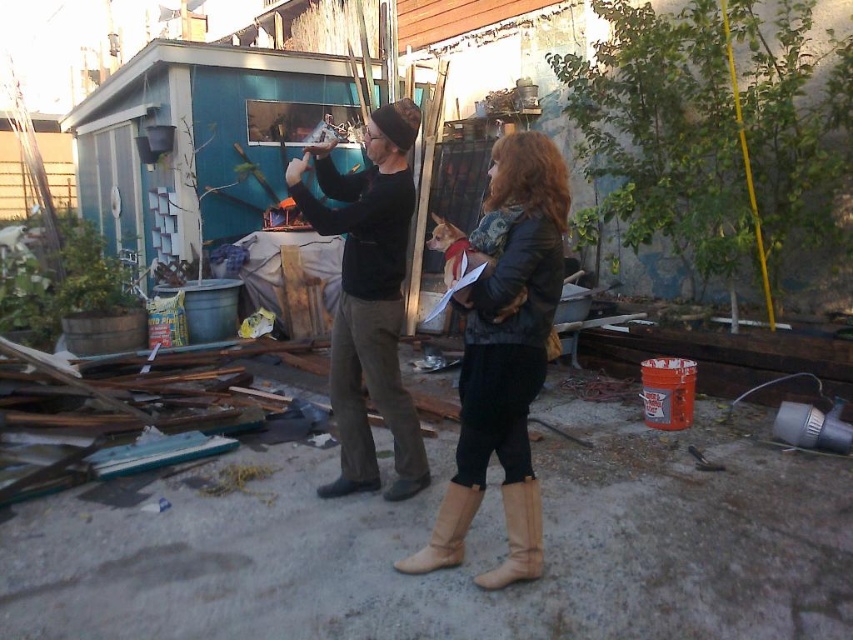
You are standing in the backyard and want to place a small potted plant between the two points labeled point (345,474) and point (520,552). Which point should the plant be closer to so that it is nearer to the viewer?

The plant should be placed closer to point (345,474) because it is closer to the viewer than point (520,552).

Based on the photo, you are a delivery person who needs to place a package between the black matte pants at center and the tan suede boots at center. The package is 30 inches long. Can you fit it between them without moving either item?

The distance between the black matte pants at center and the tan suede boots at center is 28.79 inches. Since the package is 30 inches long, it cannot fit between them without moving either item.

You are a delivery robot with a width of 24 inches. You need to navigate through the space between the black matte pants at center and the tan suede boot at lower center to deliver a package. Can you fit through this space?

The distance between the black matte pants at center and the tan suede boot at lower center is 34.78 inches. Since the robot is 24 inches wide, it can fit through the space as the distance is greater than the robot width.